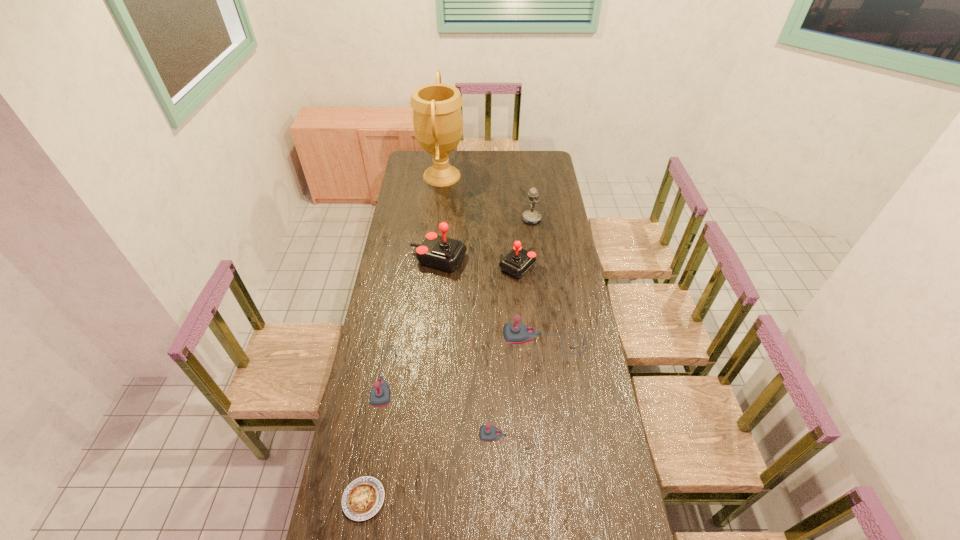
This screenshot has width=960, height=540. Identify the location of the farthest object. (437, 117).

At what (x,y) coordinates should I click in order to perform the action: click on trophy. Please return your answer as a coordinate pair (x, y). Looking at the image, I should click on (437, 117).

Locate an element on the screen. The width and height of the screenshot is (960, 540). the left red joystick is located at coordinates (441, 252).

Find the location of `the tallest joystick`. the tallest joystick is located at coordinates (441, 252).

Find the location of `microphone`. microphone is located at coordinates (531, 217).

The image size is (960, 540). What are the coordinates of `the right red joystick` in the screenshot? It's located at [x=518, y=261].

Where is `the smaller red joystick`? The width and height of the screenshot is (960, 540). the smaller red joystick is located at coordinates (518, 261).

Find the location of a particular element. This screenshot has width=960, height=540. the third shortest joystick is located at coordinates (514, 333).

Locate an element on the screen. This screenshot has height=540, width=960. the fifth shortest object is located at coordinates (514, 333).

I want to click on the fourth tallest joystick, so click(380, 394).